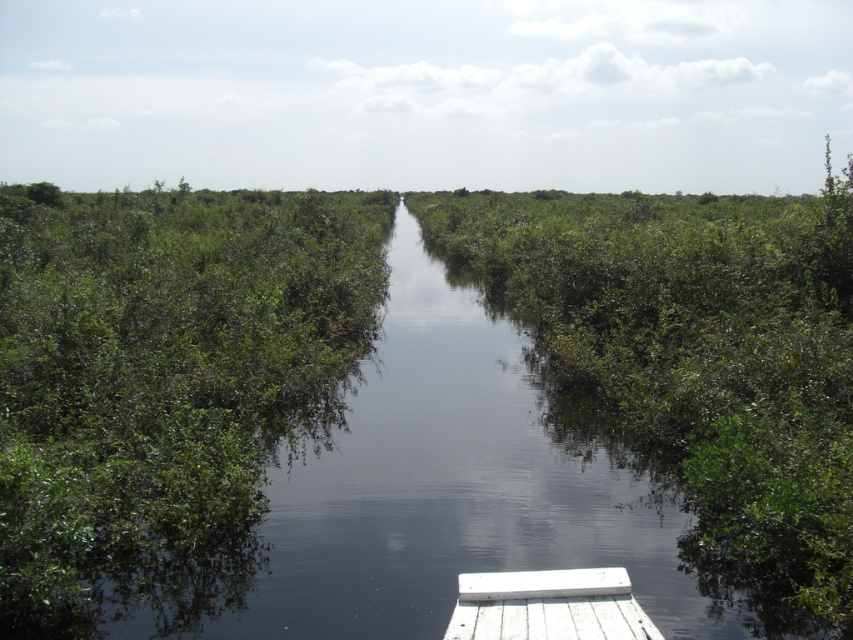
You are a small boat captain navigating through the waterway. You see the green leafy river at center and the green leafy shrubs at left. Which one is taller from your viewpoint?

The green leafy river at center is much taller than the green leafy shrubs at left, so the green leafy river at center appears taller from your viewpoint.